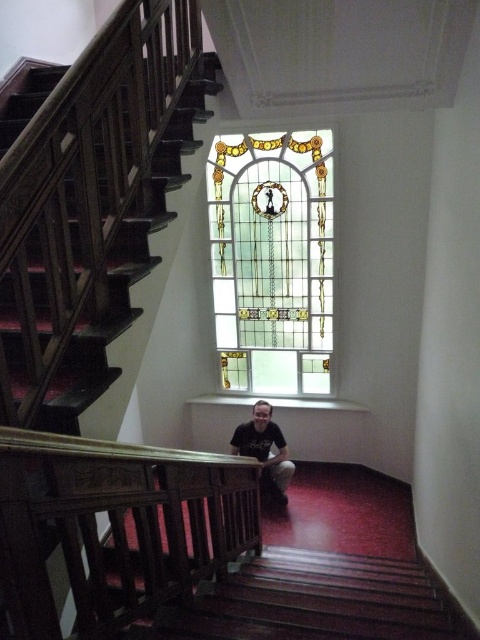
Who is more forward, (147, 540) or (237, 253)?

Point (147, 540) is in front.

Between point (91, 616) and point (283, 316), which one is positioned behind?

Point (283, 316)

You are a GUI agent. You are given a task and a screenshot of the screen. Output one action in this format:
    pyautogui.click(x=<x>, y=<y>)
    Task: Click on the dark brown wooden balustrade at center
    This screenshot has height=640, width=480.
    Given the screenshot: What is the action you would take?
    pyautogui.click(x=117, y=525)

Does dark brown wooden balustrade at center have a greater width compared to matte black shirt at center?

Indeed, dark brown wooden balustrade at center has a greater width compared to matte black shirt at center.

Measure the distance between point (20, 592) and camera.

They are 1.51 meters apart.

At what (x,y) coordinates should I click in order to perform the action: click on dark brown wooden balustrade at center. Please return your answer as a coordinate pair (x, y). This screenshot has height=640, width=480. Looking at the image, I should click on (117, 525).

Who is lower down, stained glass window at center or matte black shirt at center?

matte black shirt at center is lower down.

Is point (257, 326) in front of point (237, 436)?

No, it is not.

Is point (326, 195) positioned behind point (288, 461)?

No, (326, 195) is closer to viewer.

Locate an element on the screen. stained glass window at center is located at coordinates (273, 259).